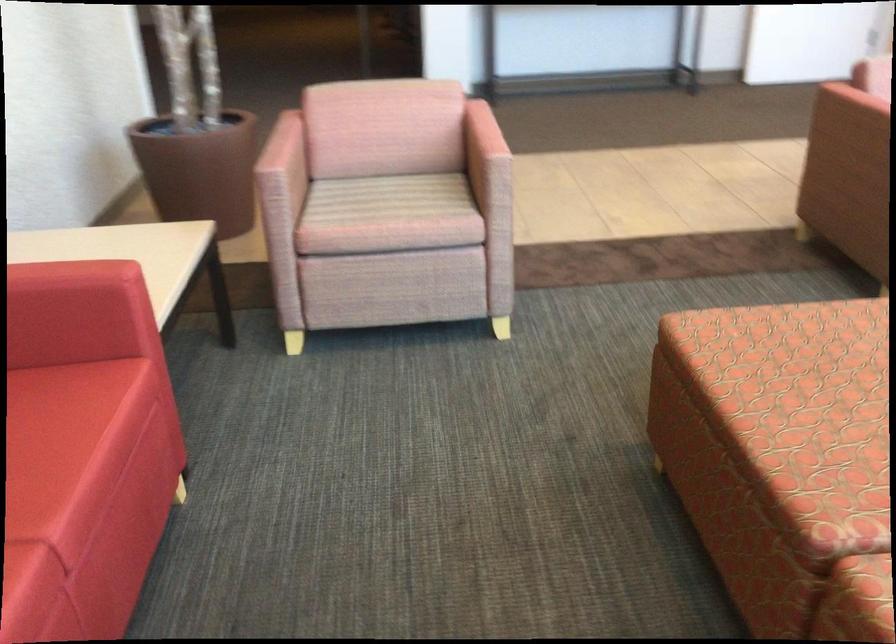
What do you see at coordinates (389, 198) in the screenshot? I see `the pink chair sitting surface` at bounding box center [389, 198].